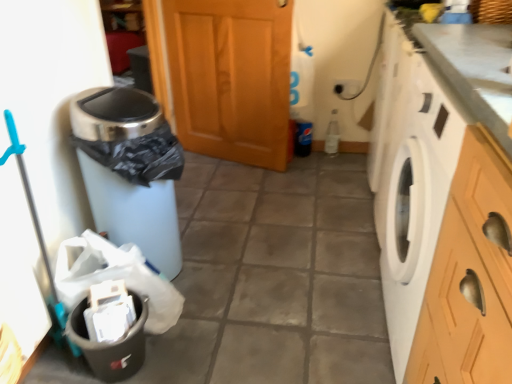
Question: From their relative heights in the image, would you say black plastic trash can at left is taller or shorter than wooden door at center?

Choices:
 (A) tall
 (B) short

Answer: (B)

Question: Is black plastic trash can at left situated inside wooden door at center or outside?

Choices:
 (A) outside
 (B) inside

Answer: (A)

Question: Estimate the real-world distances between objects in this image. Which object is farther from the black plastic recycling bin at lower left?

Choices:
 (A) matte plastic trash can at left
 (B) wooden door at center
 (C) black plastic trash can at left
 (D) white glossy washing machine at right

Answer: (B)

Question: Which of these objects is positioned farthest from the black plastic recycling bin at lower left?

Choices:
 (A) black plastic trash can at left
 (B) white glossy washing machine at right
 (C) matte plastic trash can at left
 (D) wooden door at center

Answer: (D)